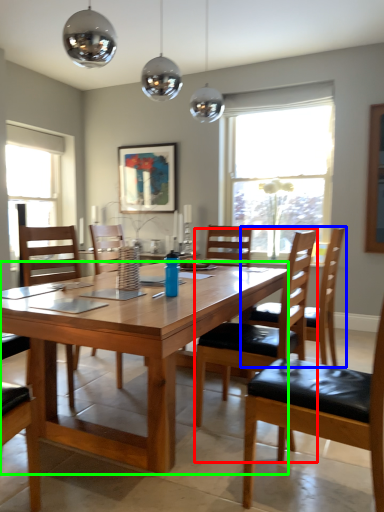
Question: Which object is positioned farthest from chair (highlighted by a red box)? Select from chair (highlighted by a blue box) and desk (highlighted by a green box).

Choices:
 (A) chair
 (B) desk

Answer: (A)